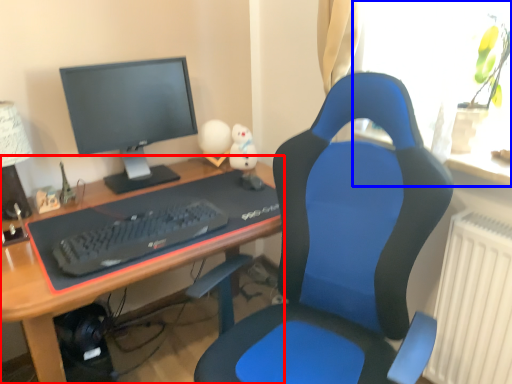
Question: Which object is closer to the camera taking this photo, desk (highlighted by a red box) or window (highlighted by a blue box)?

Choices:
 (A) desk
 (B) window

Answer: (A)